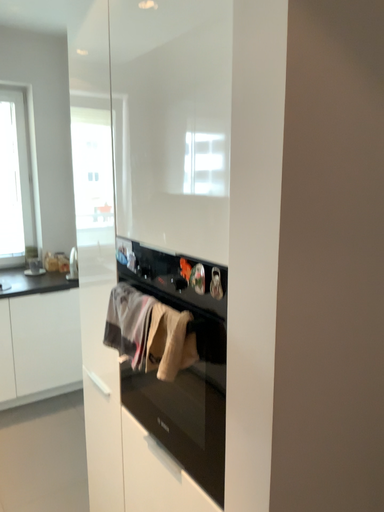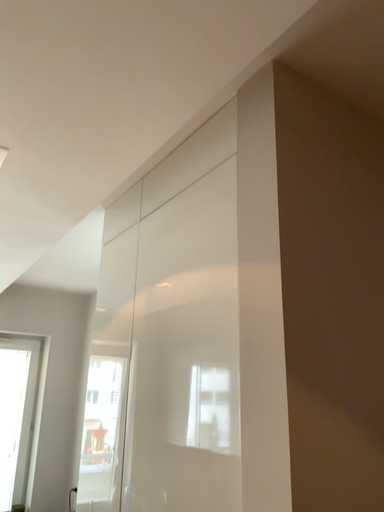
Question: Which way did the camera rotate in the video?

Choices:
 (A) rotated downward
 (B) rotated upward

Answer: (B)